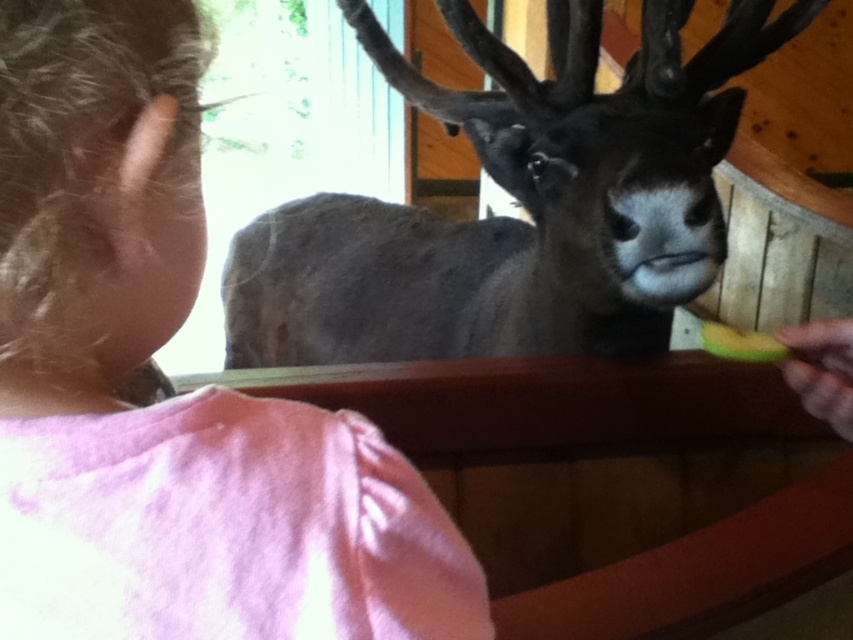
Is point (180, 525) less distant than point (682, 284)?

Yes, point (180, 525) is in front of point (682, 284).

Between point (45, 436) and point (451, 230), which one is positioned behind?

The point (451, 230) is more distant.

You are a GUI agent. You are given a task and a screenshot of the screen. Output one action in this format:
    pyautogui.click(x=<x>, y=<y>)
    Task: Click on the pink fabric shirt at upper left
    
    Given the screenshot: What is the action you would take?
    pyautogui.click(x=172, y=397)